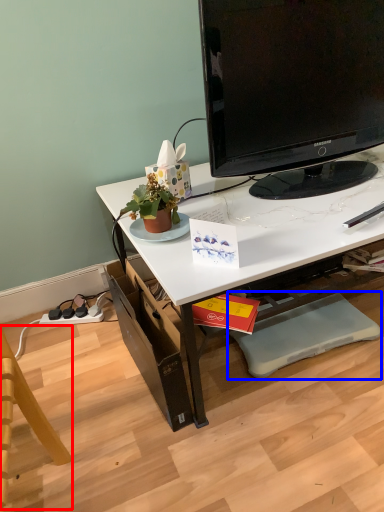
Question: Which object is further to the camera taking this photo, swivel chair (highlighted by a red box) or footrest (highlighted by a blue box)?

Choices:
 (A) swivel chair
 (B) footrest

Answer: (B)